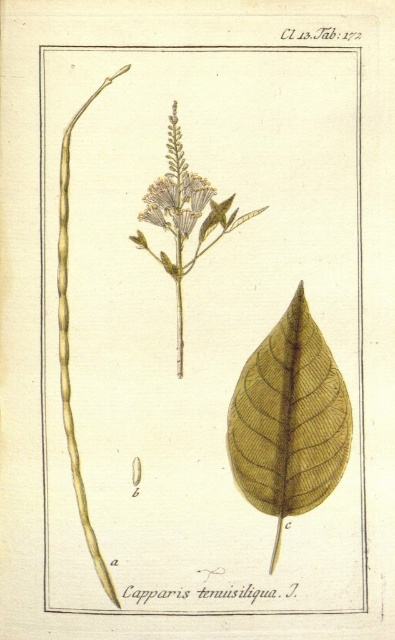
In the scene shown: Which of these two, brown textured leaf at center or light yellow textured flower at center, stands taller?

brown textured leaf at center is taller.

Can you confirm if brown textured leaf at center is positioned below light yellow textured flower at center?

Indeed, brown textured leaf at center is positioned under light yellow textured flower at center.

Is point (289, 355) positioned after point (186, 209)?

No, (289, 355) is in front of (186, 209).

The height and width of the screenshot is (640, 395). Identify the location of brown textured leaf at center. (289, 419).

Which is below, brown textured leaf at center or matte white flower at center?

brown textured leaf at center is below.

Can you confirm if brown textured leaf at center is positioned below matte white flower at center?

Yes.

Is point (308, 493) less distant than point (210, 221)?

Yes, point (308, 493) is closer to viewer.

Where is `brown textured leaf at center`? The width and height of the screenshot is (395, 640). brown textured leaf at center is located at coordinates (289, 419).

Which is below, matte white flower at center or light yellow textured flower at center?

Positioned lower is matte white flower at center.

Is matte white flower at center to the left of light yellow textured flower at center from the viewer's perspective?

Incorrect, matte white flower at center is not on the left side of light yellow textured flower at center.

Which is in front, point (197, 218) or point (150, 202)?

Point (150, 202) is in front.

Where is `matte white flower at center`? matte white flower at center is located at coordinates (184, 216).